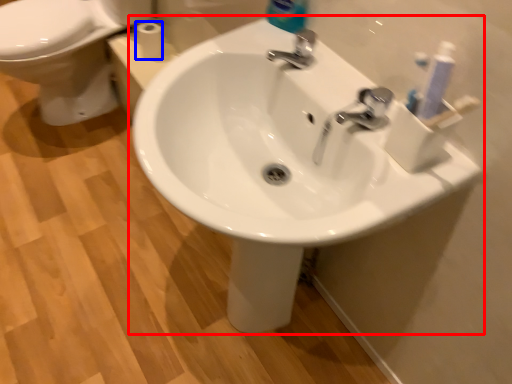
Question: Which point is further to the camera, sink (highlighted by a red box) or toilet paper (highlighted by a blue box)?

Choices:
 (A) sink
 (B) toilet paper

Answer: (B)